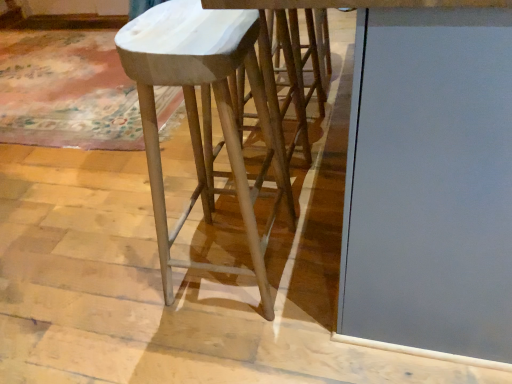
Find the location of a particular element. vacant space underneath white marble stool at center (from a real-world perspective) is located at coordinates (222, 261).